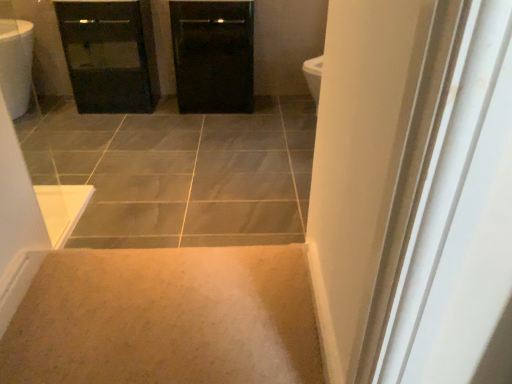
Identify the location of black glossy cabinet at center. Image resolution: width=512 pixels, height=384 pixels. (213, 55).

What's the angular difference between beige carpet at lower center and black glossy cabinet at upper left's facing directions?

The angle between the facing direction of beige carpet at lower center and the facing direction of black glossy cabinet at upper left is 180 degrees.

Which point is more distant from viewer, (123,303) or (147,17)?

The point (147,17) is more distant.

Identify the location of plain on the right side of black glossy cabinet at upper left. (166, 318).

Could you tell me if beige carpet at lower center is facing black glossy cabinet at upper left?

Yes, beige carpet at lower center faces towards black glossy cabinet at upper left.

Is black glossy cabinet at center completely or partially outside of beige carpet at lower center?

Yes, black glossy cabinet at center is outside of beige carpet at lower center.

Which is in front, point (182, 66) or point (247, 331)?

The point (247, 331) is closer.

Is black glossy cabinet at center beside beige carpet at lower center?

No, black glossy cabinet at center is not making contact with beige carpet at lower center.

Where is `plain that is below the black glossy cabinet at center (from the image's perspective)`? The width and height of the screenshot is (512, 384). plain that is below the black glossy cabinet at center (from the image's perspective) is located at coordinates (166, 318).

Consider the image. Is the position of black glossy cabinet at upper left more distant than that of beige carpet at lower center?

Yes.

From a real-world perspective, relative to beige carpet at lower center, is black glossy cabinet at upper left vertically above or below?

black glossy cabinet at upper left is situated higher than beige carpet at lower center in the real world.

How many degrees apart are the facing directions of black glossy cabinet at upper left and beige carpet at lower center?

black glossy cabinet at upper left and beige carpet at lower center are facing 180 degrees away from each other.

Is black glossy cabinet at upper left at the right side of black glossy cabinet at center?

No, black glossy cabinet at upper left is not to the right of black glossy cabinet at center.

How different are the orientations of black glossy cabinet at upper left and black glossy cabinet at center in degrees?

The angular difference between black glossy cabinet at upper left and black glossy cabinet at center is 0.000598 degrees.

Considering the positions of point (121, 107) and point (222, 94), is point (121, 107) closer or farther from the camera than point (222, 94)?

Point (121, 107) is positioned farther from the camera compared to point (222, 94).

Is black glossy cabinet at upper left inside or outside of black glossy cabinet at center?

black glossy cabinet at upper left is located beyond the bounds of black glossy cabinet at center.

Considering the points (253, 247) and (216, 36), which point is in front, point (253, 247) or point (216, 36)?

Point (253, 247)

Is beige carpet at lower center to the right of black glossy cabinet at center from the viewer's perspective?

Yes.

Is black glossy cabinet at center at the back of beige carpet at lower center?

beige carpet at lower center is not turned away from black glossy cabinet at center.

The width and height of the screenshot is (512, 384). In order to click on plain on the right of black glossy cabinet at center in this screenshot , I will do `click(166, 318)`.

Considering the sizes of objects black glossy cabinet at center and black glossy cabinet at upper left in the image provided, who is shorter, black glossy cabinet at center or black glossy cabinet at upper left?

Standing shorter between the two is black glossy cabinet at center.

From the image's perspective, which one is positioned lower, black glossy cabinet at center or black glossy cabinet at upper left?

From the image's view, black glossy cabinet at upper left is below.

Is black glossy cabinet at center situated inside black glossy cabinet at upper left or outside?

black glossy cabinet at center cannot be found inside black glossy cabinet at upper left.

The width and height of the screenshot is (512, 384). In order to click on plain below the black glossy cabinet at upper left (from a real-world perspective) in this screenshot , I will do `click(166, 318)`.

Locate an element on the screen. This screenshot has width=512, height=384. door on the left side of beige carpet at lower center is located at coordinates (213, 55).

From the image, which object appears to be nearer to black glossy cabinet at upper left, black glossy cabinet at center or beige carpet at lower center?

black glossy cabinet at center.

In the scene shown: Considering their positions, is black glossy cabinet at center positioned further to beige carpet at lower center than black glossy cabinet at upper left?

Among the two, black glossy cabinet at upper left is located further to beige carpet at lower center.

Considering their positions, is black glossy cabinet at upper left positioned further to beige carpet at lower center than black glossy cabinet at center?

black glossy cabinet at upper left is positioned further to the anchor beige carpet at lower center.

Estimate the real-world distances between objects in this image. Which object is closer to black glossy cabinet at center, beige carpet at lower center or black glossy cabinet at upper left?

black glossy cabinet at upper left lies closer to black glossy cabinet at center than the other object.

When comparing their distances from black glossy cabinet at center, does black glossy cabinet at upper left or beige carpet at lower center seem closer?

black glossy cabinet at upper left.

Which object lies further to the anchor point black glossy cabinet at upper left, beige carpet at lower center or black glossy cabinet at center?

beige carpet at lower center.

Where is `bathroom cabinet located between beige carpet at lower center and black glossy cabinet at center in the depth direction`? The width and height of the screenshot is (512, 384). bathroom cabinet located between beige carpet at lower center and black glossy cabinet at center in the depth direction is located at coordinates (109, 54).